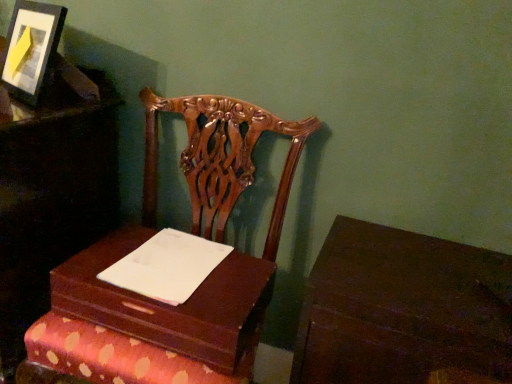
Question: From the image's perspective, is wooden chair at left, which is the first furniture in left-to-right order, on wooden box at center?

Choices:
 (A) yes
 (B) no

Answer: (A)

Question: Is wooden box at center surrounded by wooden chair at left, marked as the 2th furniture in a right-to-left arrangement?

Choices:
 (A) no
 (B) yes

Answer: (A)

Question: From a real-world perspective, is wooden chair at left, which is the first furniture in left-to-right order, on wooden box at center?

Choices:
 (A) yes
 (B) no

Answer: (B)

Question: Considering the relative positions of wooden chair at left, which is the first furniture in left-to-right order, and wooden box at center in the image provided, is wooden chair at left, which is the first furniture in left-to-right order, to the right of wooden box at center from the viewer's perspective?

Choices:
 (A) yes
 (B) no

Answer: (B)

Question: Is wooden chair at left, marked as the 2th furniture in a right-to-left arrangement, looking in the opposite direction of wooden box at center?

Choices:
 (A) no
 (B) yes

Answer: (A)

Question: Is point (199, 319) closer or farther from the camera than point (17, 89)?

Choices:
 (A) farther
 (B) closer

Answer: (B)

Question: In terms of width, does mahogany wood chair at center, the 1th furniture positioned from the right, look wider or thinner when compared to matte black picture frame at upper left?

Choices:
 (A) wide
 (B) thin

Answer: (A)

Question: Considering the relative positions of mahogany wood chair at center, the 2th furniture viewed from the left, and matte black picture frame at upper left in the image provided, is mahogany wood chair at center, the 2th furniture viewed from the left, to the left or to the right of matte black picture frame at upper left?

Choices:
 (A) left
 (B) right

Answer: (B)

Question: Is mahogany wood chair at center, the 2th furniture viewed from the left, taller or shorter than matte black picture frame at upper left?

Choices:
 (A) short
 (B) tall

Answer: (B)

Question: Is matte black picture frame at upper left taller or shorter than white paper at center?

Choices:
 (A) short
 (B) tall

Answer: (B)

Question: Looking at the image, does matte black picture frame at upper left seem bigger or smaller compared to white paper at center?

Choices:
 (A) small
 (B) big

Answer: (B)

Question: From the image's perspective, is matte black picture frame at upper left positioned above or below white paper at center?

Choices:
 (A) above
 (B) below

Answer: (A)

Question: Choose the correct answer: Is matte black picture frame at upper left inside white paper at center or outside it?

Choices:
 (A) outside
 (B) inside

Answer: (A)

Question: Is point (139, 296) closer or farther from the camera than point (353, 352)?

Choices:
 (A) farther
 (B) closer

Answer: (A)

Question: In the image, is wooden box at center on the left side or the right side of dark wood table at lower right?

Choices:
 (A) right
 (B) left

Answer: (B)